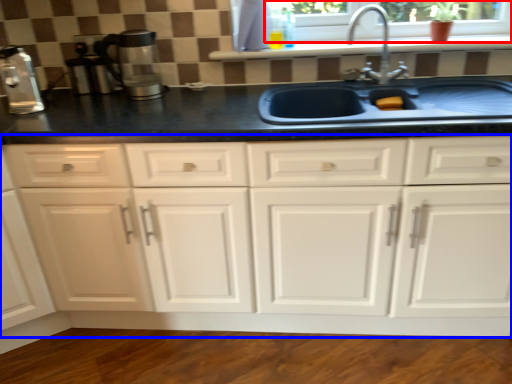
Question: Which object appears closest to the camera in this image, window frame (highlighted by a red box) or cabinetry (highlighted by a blue box)?

Choices:
 (A) window frame
 (B) cabinetry

Answer: (B)